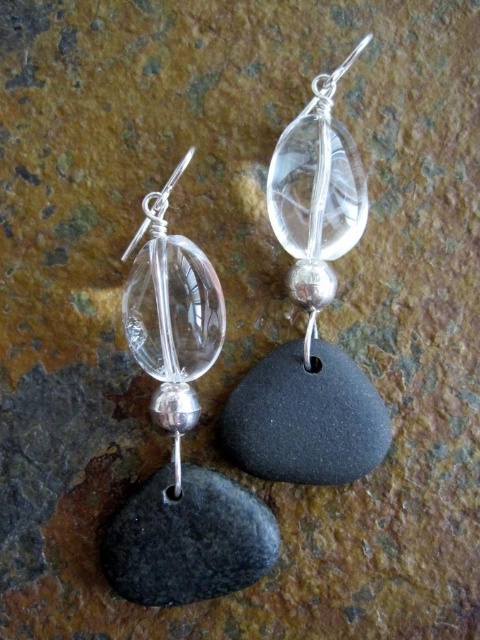
You are an appraiser examining the placement of the clear glass stone in the image. The clear glass stone is located at point (180,435). Can you confirm if this position is to the lower left of the silver bead in the same earring?

The clear glass stone at lower left is positioned at point (180,435), which is indeed to the lower left of the silver bead in the same earring.

You are a jeweler who wants to place both the clear glass stone at center and the black matte stone at lower left into a rectangular display case. The case has a length of 10 inches. Can both stones fit side by side in the case without overlapping?

The clear glass stone at center and the black matte stone at lower left are 9.60 inches apart. Since the display case is 10 inches long, there is enough space to fit both stones side by side without overlapping.

You are standing 5 feet away from the earrings displayed on the textured surface. There is a specific point marked at coordinates point (219, 547). Can you reach this point without moving closer than 4 feet to the earrings?

The point (219, 547) is 4.18 feet away from the viewer. Since you are currently 5 feet away, you need to move 0.82 feet closer to reach it. However, moving to 4.18 feet would be within the 4 feet restriction, so you cannot reach the point without moving closer than 4 feet.